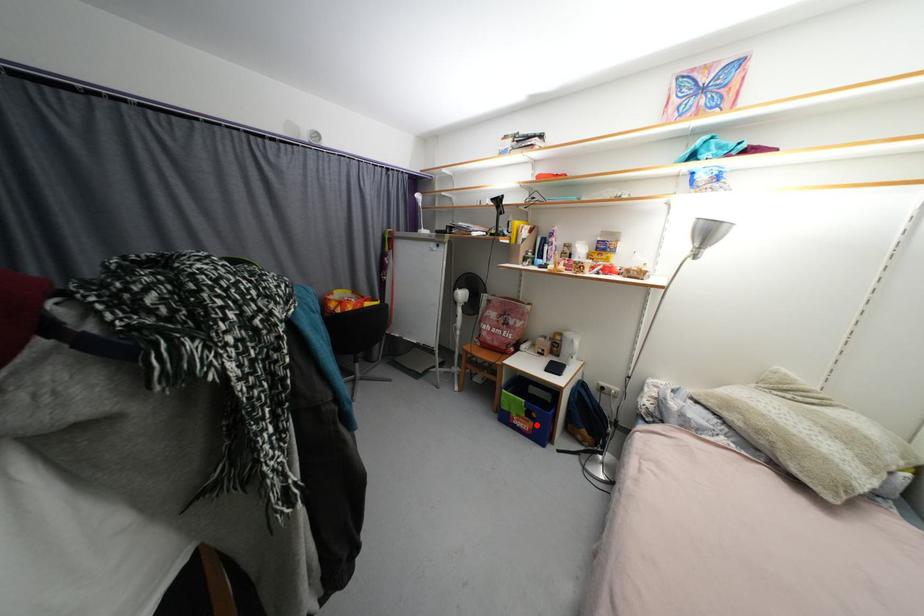
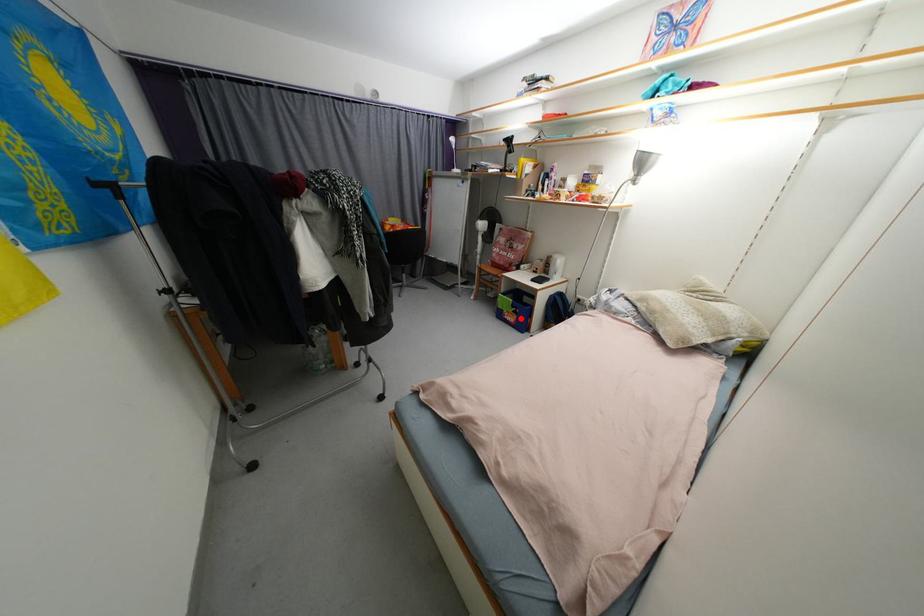
I am providing you with two images of the same scene from different viewpoints. A red point is marked on the first image and another point is marked on the second image. Do the highlighted points in image1 and image2 indicate the same real-world spot?

Yes